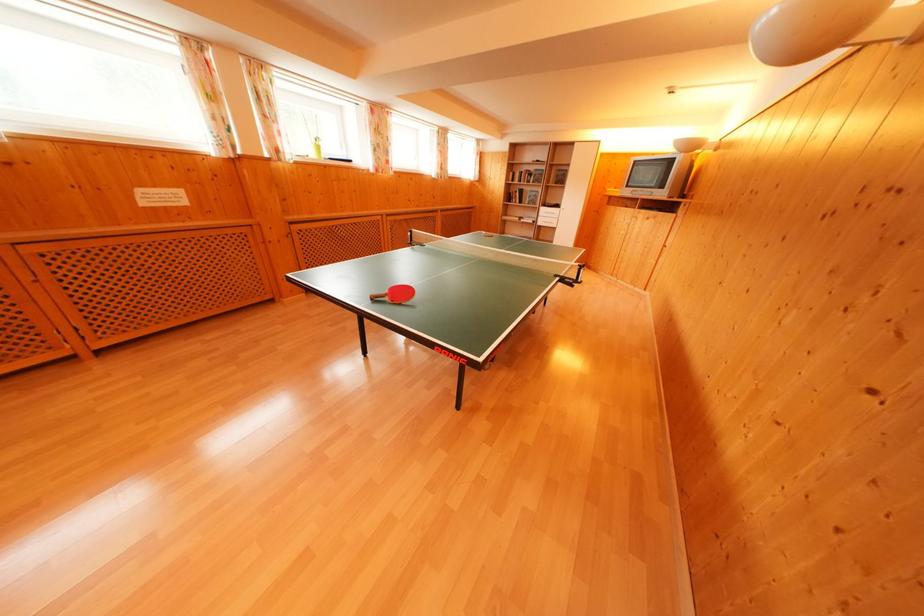
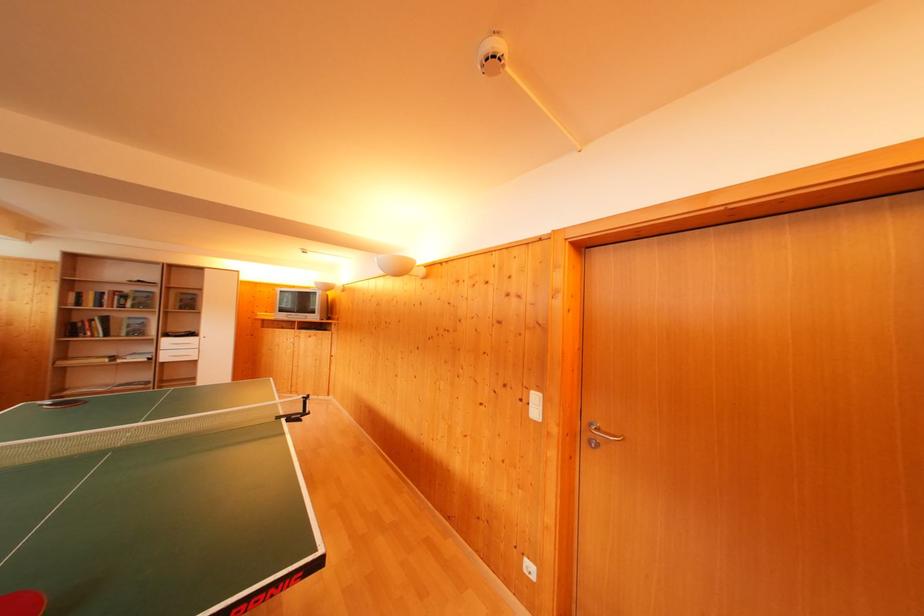
The point at (x=514, y=203) is marked in the first image. Where is the corresponding point in the second image?

(76, 334)